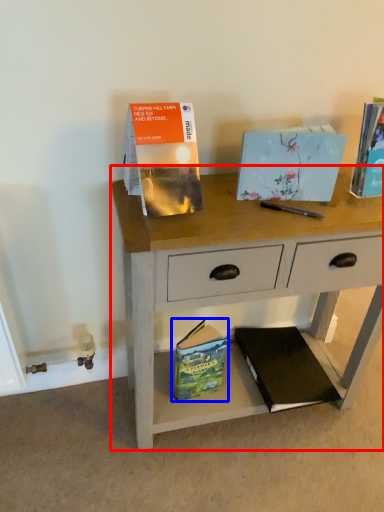
Question: Among these objects, which one is nearest to the camera, desk (highlighted by a red box) or paperback book (highlighted by a blue box)?

Choices:
 (A) desk
 (B) paperback book

Answer: (A)